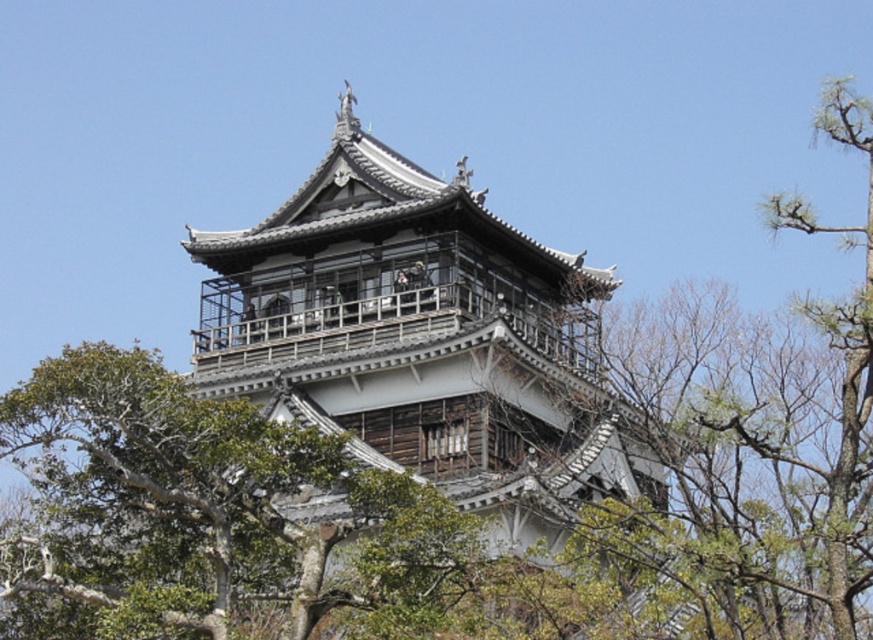
Question: Does gray wooden pagoda at center have a larger size compared to green leafy tree at upper right?

Choices:
 (A) yes
 (B) no

Answer: (B)

Question: Which point is farther to the camera?

Choices:
 (A) green leafy tree at upper right
 (B) gray wooden pagoda at center

Answer: (B)

Question: Which point is farther to the camera?

Choices:
 (A) (593, 442)
 (B) (843, 442)

Answer: (A)

Question: Can you confirm if gray wooden pagoda at center is positioned to the left of green leafy tree at upper right?

Choices:
 (A) yes
 (B) no

Answer: (A)

Question: Does gray wooden pagoda at center have a greater width compared to green leafy tree at upper right?

Choices:
 (A) no
 (B) yes

Answer: (A)